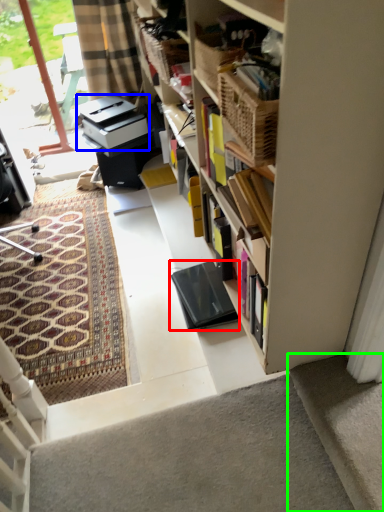
Question: Considering the real-world distances, which object is farthest from equipment (highlighted by a red box)? printer (highlighted by a blue box) or concrete (highlighted by a green box)?

Choices:
 (A) printer
 (B) concrete

Answer: (A)